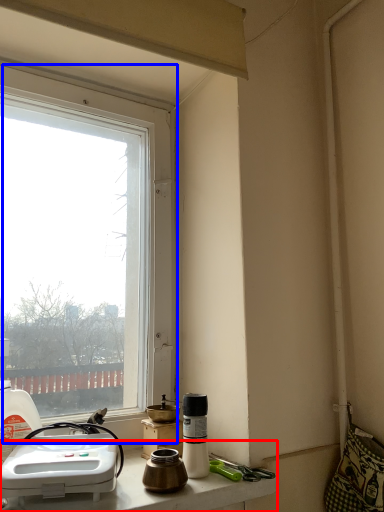
Question: Which of the following is the closest to the observer, counter top (highlighted by a red box) or window (highlighted by a blue box)?

Choices:
 (A) counter top
 (B) window

Answer: (A)